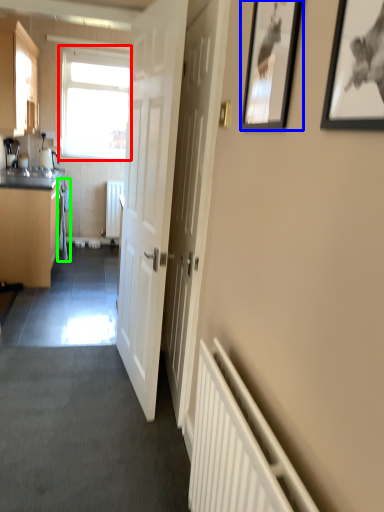
Question: Which is farther away from window (highlighted by a red box)? picture frame (highlighted by a blue box) or laundry (highlighted by a green box)?

Choices:
 (A) picture frame
 (B) laundry

Answer: (A)